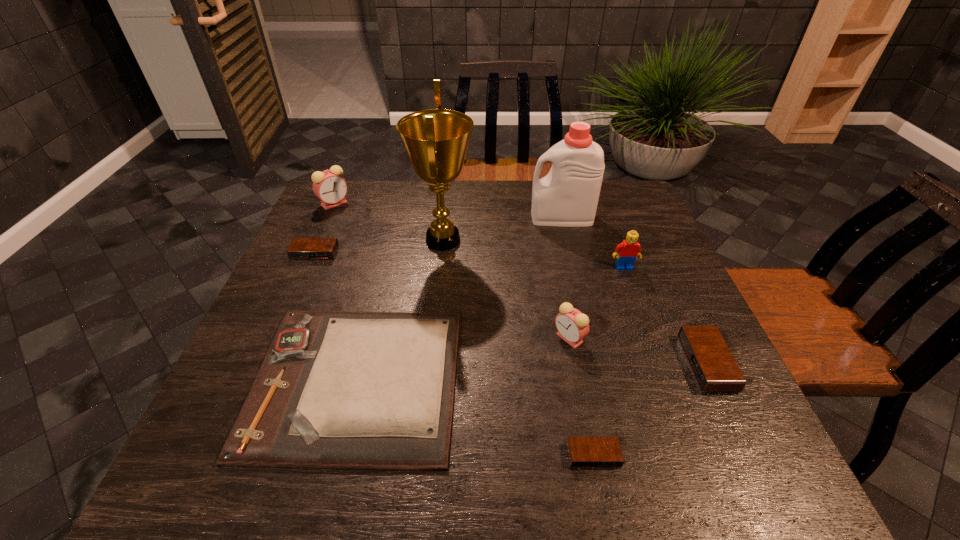
The width and height of the screenshot is (960, 540). Identify the location of the tallest object. (436, 140).

Identify the location of award. This screenshot has height=540, width=960. (436, 140).

You are a GUI agent. You are given a task and a screenshot of the screen. Output one action in this format:
    pyautogui.click(x=<x>, y=<y>)
    Task: Click on the eighth shortest object
    Image resolution: width=960 pixels, height=540 pixels.
    Given the screenshot: What is the action you would take?
    pyautogui.click(x=567, y=196)

You are a GUI agent. You are given a task and a screenshot of the screen. Output one action in this format:
    pyautogui.click(x=<x>, y=<y>)
    Task: Click on the white detergent
    This screenshot has height=540, width=960.
    Given the screenshot: What is the action you would take?
    pyautogui.click(x=567, y=196)

This screenshot has width=960, height=540. I want to click on the farthest alarm clock, so click(x=329, y=186).

Identify the location of the tallest alarm clock. The height and width of the screenshot is (540, 960). (329, 186).

This screenshot has height=540, width=960. What are the coordinates of `red Lego` in the screenshot? It's located at (627, 251).

You are a GUI agent. You are given a task and a screenshot of the screen. Output one action in this format:
    pyautogui.click(x=<x>, y=<y>)
    Task: Click on the right pink alarm clock
    The width and height of the screenshot is (960, 540).
    Given the screenshot: What is the action you would take?
    pyautogui.click(x=572, y=325)

You are a GUI agent. You are given a task and a screenshot of the screen. Output one action in this format:
    pyautogui.click(x=<x>, y=<y>)
    Task: Click on the fifth shortest object
    The width and height of the screenshot is (960, 540).
    Given the screenshot: What is the action you would take?
    pyautogui.click(x=572, y=325)

This screenshot has height=540, width=960. Identify the location of the rightmost alarm clock. (714, 367).